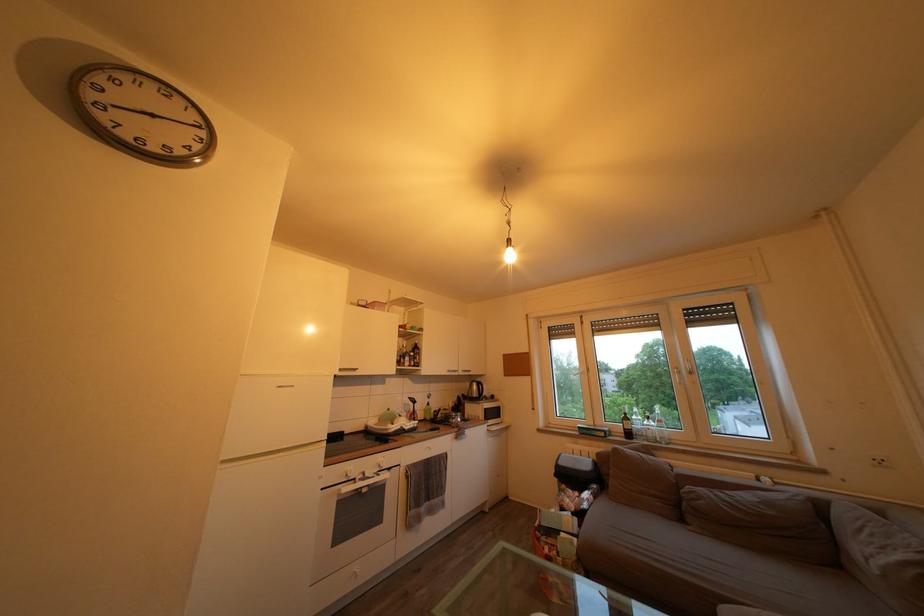
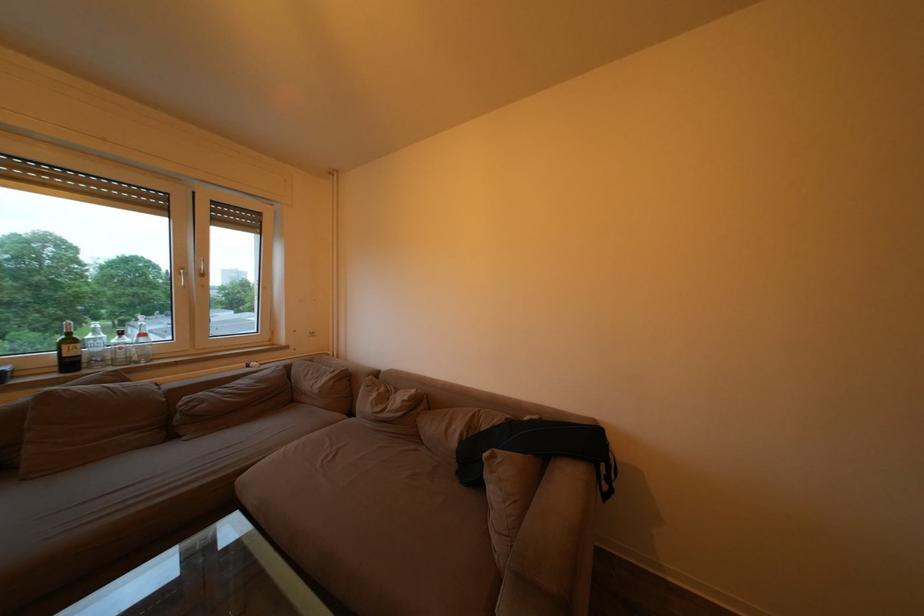
Locate, in the second image, the point that corresponds to point (657, 424) in the first image.

(129, 339)